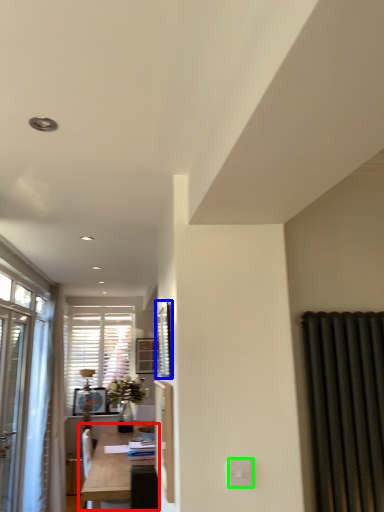
Question: Estimate the real-world distances between objects in this image. Which object is closer to table (highlighted by a red box), window screen (highlighted by a blue box) or electric outlet (highlighted by a green box)?

Choices:
 (A) window screen
 (B) electric outlet

Answer: (A)